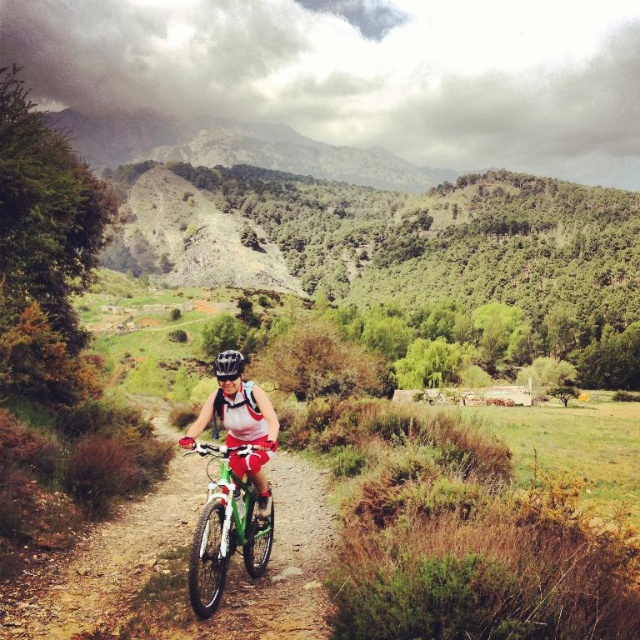
You are a photographer planning to take a photo of the green matte bicycle at center and the matte white helmet at center. Based on their sizes in the image, which object should you focus on if you want to capture both in a way that the smaller object is clearly visible without being too small?

The green matte bicycle at center is shorter than the matte white helmet at center, so you should focus on the green matte bicycle at center to ensure it is clearly visible since it is the smaller object.

You are a photographer trying to capture the rider and their bike in the scene. The green matte bicycle at center and the matte white helmet at center are both in view. Which object is positioned more to the left side of the frame?

The green matte bicycle at center is positioned to the left of the matte white helmet at center, so it is more to the left side of the frame.

You are a photographer trying to capture a clear shot of both the matte white helmet at center and the black matte bicycle helmet at center. Since you can only focus on one helmet at a time, which helmet should you focus on to ensure the other is still somewhat in the frame?

The matte white helmet at center is positioned on the right side of black matte bicycle helmet at center, so focusing on the black matte bicycle helmet at center would keep the matte white helmet at center within the frame to the right.